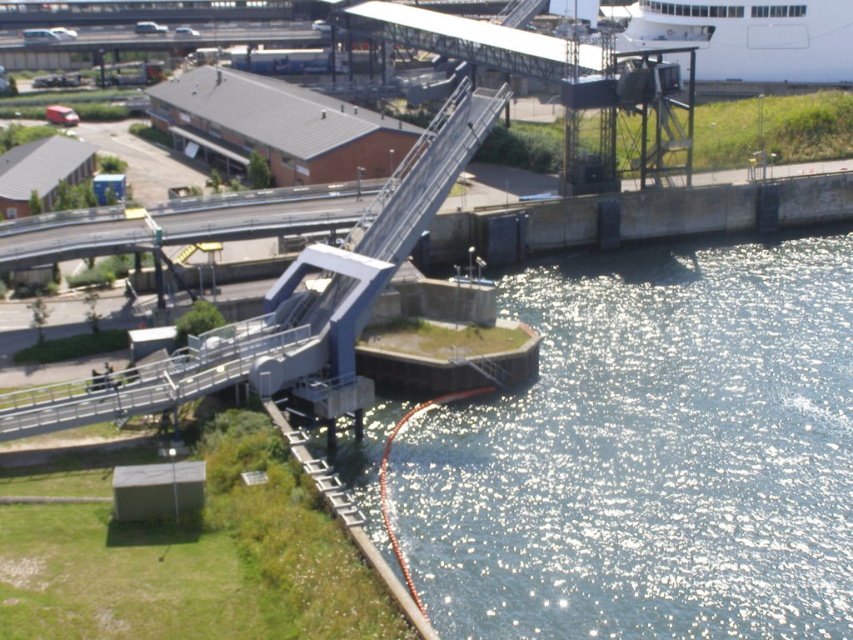
You are a delivery drone with a wingspan of 1.5 meters. You need to fly from the shiny metallic water at lower right to the silver metallic rail at lower left. Is there enough space for you to pass through the gap between them?

The gap between the shiny metallic water at lower right and silver metallic rail at lower left is 14.57 meters, which is significantly wider than the drone wingspan of 1.5 meters. Yes, there is enough space for the drone to pass through the gap safely.

You are a photographer standing on the dock and want to capture both the shiny metallic water at lower right and the white glossy cruise ship at upper right in the same frame. Which object should you position closer to the bottom of your camera viewfinder?

You should position the shiny metallic water at lower right closer to the bottom of your camera viewfinder because it is located below the white glossy cruise ship at upper right.

You are standing on the pedestrian walkway and want to take a photo of the shiny metallic water at lower right without the silver metallic rail at lower left blocking the view. Is it possible to position yourself in such a way that the rail is not visible in the photo?

Yes, because the shiny metallic water at lower right is in front of the silver metallic rail at lower left, so positioning yourself closer to the water would allow you to frame the shot without the rail obstructing the view.